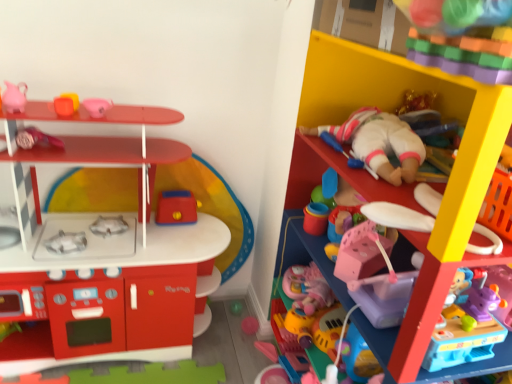
Question: Considering the relative sizes of pink matte pitcher at upper left, the ninth toy positioned from the right, and pink rubber duck at upper left, placed as the fifth toy when sorted from left to right, in the image provided, is pink matte pitcher at upper left, the ninth toy positioned from the right, smaller than pink rubber duck at upper left, placed as the fifth toy when sorted from left to right,?

Choices:
 (A) yes
 (B) no

Answer: (B)

Question: Is pink matte pitcher at upper left, which is the 1th toy in left-to-right order, closer to the viewer compared to pink rubber duck at upper left, placed as the fifth toy when sorted from left to right?

Choices:
 (A) yes
 (B) no

Answer: (A)

Question: Is pink matte pitcher at upper left, the ninth toy positioned from the right, outside of pink rubber duck at upper left, acting as the 5th toy starting from the right?

Choices:
 (A) yes
 (B) no

Answer: (A)

Question: Considering the relative sizes of pink matte pitcher at upper left, which is the 1th toy in left-to-right order, and pink rubber duck at upper left, placed as the fifth toy when sorted from left to right, in the image provided, is pink matte pitcher at upper left, which is the 1th toy in left-to-right order, wider than pink rubber duck at upper left, placed as the fifth toy when sorted from left to right,?

Choices:
 (A) yes
 (B) no

Answer: (B)

Question: Is pink matte pitcher at upper left, which is the 1th toy in left-to-right order, further to camera compared to pink rubber duck at upper left, placed as the fifth toy when sorted from left to right?

Choices:
 (A) yes
 (B) no

Answer: (B)

Question: Does pink matte pitcher at upper left, which is the 1th toy in left-to-right order, appear on the right side of pink rubber duck at upper left, placed as the fifth toy when sorted from left to right?

Choices:
 (A) yes
 (B) no

Answer: (B)

Question: Is the depth of white plastic spoon at upper right, marked as the second toy in a right-to-left arrangement, less than that of rubber duck at upper left, positioned as the third toy in left-to-right order?

Choices:
 (A) yes
 (B) no

Answer: (A)

Question: Considering the relative sizes of white plastic spoon at upper right, marked as the second toy in a right-to-left arrangement, and rubber duck at upper left, the seventh toy when ordered from right to left, in the image provided, is white plastic spoon at upper right, marked as the second toy in a right-to-left arrangement, shorter than rubber duck at upper left, the seventh toy when ordered from right to left,?

Choices:
 (A) yes
 (B) no

Answer: (A)

Question: Can you confirm if white plastic spoon at upper right, acting as the 8th toy starting from the left, is thinner than rubber duck at upper left, positioned as the third toy in left-to-right order?

Choices:
 (A) yes
 (B) no

Answer: (B)

Question: Could you tell me if white plastic spoon at upper right, acting as the 8th toy starting from the left, is facing rubber duck at upper left, the seventh toy when ordered from right to left?

Choices:
 (A) no
 (B) yes

Answer: (A)

Question: Does white plastic spoon at upper right, acting as the 8th toy starting from the left, appear on the left side of rubber duck at upper left, the seventh toy when ordered from right to left?

Choices:
 (A) no
 (B) yes

Answer: (A)

Question: Can you confirm if white plastic spoon at upper right, acting as the 8th toy starting from the left, is smaller than rubber duck at upper left, positioned as the third toy in left-to-right order?

Choices:
 (A) no
 (B) yes

Answer: (A)

Question: Considering the relative sizes of rubberized red toaster at center, the sixth toy in the left-to-right sequence, and pink matte pitcher at upper left, the ninth toy positioned from the right, in the image provided, is rubberized red toaster at center, the sixth toy in the left-to-right sequence, smaller than pink matte pitcher at upper left, the ninth toy positioned from the right,?

Choices:
 (A) no
 (B) yes

Answer: (A)